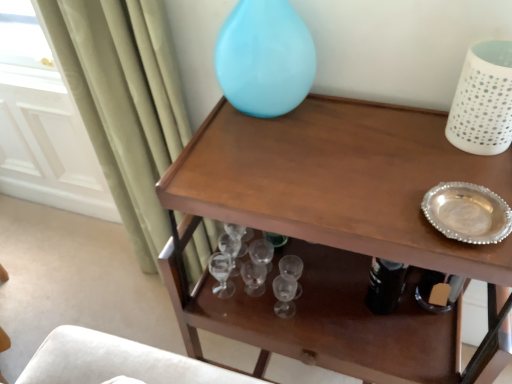
The height and width of the screenshot is (384, 512). Identify the location of white perforated vase at upper right, which is counted as the 1th vase, starting from the right. (483, 100).

Locate an element on the screen. glossy glass vase at upper center, the first vase in the left-to-right sequence is located at coordinates (265, 58).

Is white perforated vase at upper right, the second vase positioned from the left, outside of glossy glass vase at upper center, the first vase in the left-to-right sequence?

Yes, white perforated vase at upper right, the second vase positioned from the left, is located beyond the bounds of glossy glass vase at upper center, the first vase in the left-to-right sequence.

From a real-world perspective, which object rests below the other?

white perforated vase at upper right, the second vase positioned from the left, from a real-world perspective.

Is point (478, 131) in front of point (236, 16)?

Yes, point (478, 131) is closer to viewer.

Is white perforated vase at upper right, the second vase positioned from the left, positioned with its back to glossy glass vase at upper center, the first vase in the left-to-right sequence?

No, white perforated vase at upper right, the second vase positioned from the left,'s orientation is not away from glossy glass vase at upper center, the first vase in the left-to-right sequence.

From the image's perspective, between wooden table at upper center and white perforated vase at upper right, which is counted as the 1th vase, starting from the right, which one is located above?

white perforated vase at upper right, which is counted as the 1th vase, starting from the right, is shown above in the image.

How distant is wooden table at upper center from white perforated vase at upper right, which is counted as the 1th vase, starting from the right?

A distance of 32.85 centimeters exists between wooden table at upper center and white perforated vase at upper right, which is counted as the 1th vase, starting from the right.

Would you say white perforated vase at upper right, the second vase positioned from the left, is part of wooden table at upper center's contents?

No, white perforated vase at upper right, the second vase positioned from the left, is not surrounded by wooden table at upper center.

From a real-world perspective, who is located higher, wooden table at upper center or white perforated vase at upper right, the second vase positioned from the left?

white perforated vase at upper right, the second vase positioned from the left, is physically above.

Considering the positions of objects glossy glass vase at upper center, the first vase in the left-to-right sequence, and wooden table at upper center in the image provided, who is more to the right, glossy glass vase at upper center, the first vase in the left-to-right sequence, or wooden table at upper center?

wooden table at upper center.

From the image's perspective, would you say glossy glass vase at upper center, marked as the 2th vase in a right-to-left arrangement, is shown under wooden table at upper center?

Actually, glossy glass vase at upper center, marked as the 2th vase in a right-to-left arrangement, appears above wooden table at upper center in the image.

From the picture: Are glossy glass vase at upper center, the first vase in the left-to-right sequence, and wooden table at upper center located far from each other?

That's not correct — glossy glass vase at upper center, the first vase in the left-to-right sequence, is a little close to wooden table at upper center.

From the image's perspective, which object appears higher, wooden table at upper center or glossy glass vase at upper center, the first vase in the left-to-right sequence?

From the image's view, glossy glass vase at upper center, the first vase in the left-to-right sequence, is above.

Could you tell me if wooden table at upper center is turned towards glossy glass vase at upper center, the first vase in the left-to-right sequence?

No, wooden table at upper center does not turn towards glossy glass vase at upper center, the first vase in the left-to-right sequence.

Which object is more forward, wooden table at upper center or glossy glass vase at upper center, marked as the 2th vase in a right-to-left arrangement?

wooden table at upper center is in front.

From the image's perspective, starting from the wooden table at upper center, which vase is the 2nd one above? Please provide its 2D coordinates.

[(265, 58)]

Is point (492, 152) farther from camera compared to point (308, 226)?

That is True.

Which object is positioned more to the left, white perforated vase at upper right, which is counted as the 1th vase, starting from the right, or wooden table at upper center?

wooden table at upper center is more to the left.

From a real-world perspective, is white perforated vase at upper right, the second vase positioned from the left, positioned over wooden table at upper center based on gravity?

Yes.

Between white perforated vase at upper right, the second vase positioned from the left, and wooden table at upper center, which one has smaller width?

white perforated vase at upper right, the second vase positioned from the left.

Which object is more forward, glossy glass vase at upper center, the first vase in the left-to-right sequence, or white perforated vase at upper right, which is counted as the 1th vase, starting from the right?

Positioned in front is white perforated vase at upper right, which is counted as the 1th vase, starting from the right.

Which of these two, glossy glass vase at upper center, the first vase in the left-to-right sequence, or white perforated vase at upper right, the second vase positioned from the left, is thinner?

glossy glass vase at upper center, the first vase in the left-to-right sequence.

Are glossy glass vase at upper center, the first vase in the left-to-right sequence, and white perforated vase at upper right, which is counted as the 1th vase, starting from the right, beside each other?

No.

What are the coordinates of `vase above the white perforated vase at upper right, the second vase positioned from the left (from a real-world perspective)` in the screenshot? It's located at (265, 58).

I want to click on table on the left side of white perforated vase at upper right, which is counted as the 1th vase, starting from the right, so click(335, 234).

From the image, which object appears to be nearer to glossy glass vase at upper center, the first vase in the left-to-right sequence, white perforated vase at upper right, which is counted as the 1th vase, starting from the right, or wooden table at upper center?

wooden table at upper center.

When comparing their distances from wooden table at upper center, does white perforated vase at upper right, which is counted as the 1th vase, starting from the right, or glossy glass vase at upper center, marked as the 2th vase in a right-to-left arrangement, seem closer?

glossy glass vase at upper center, marked as the 2th vase in a right-to-left arrangement, is positioned closer to the anchor wooden table at upper center.

Looking at the image, which one is located further to wooden table at upper center, glossy glass vase at upper center, marked as the 2th vase in a right-to-left arrangement, or white perforated vase at upper right, the second vase positioned from the left?

white perforated vase at upper right, the second vase positioned from the left.

From the image, which object appears to be nearer to glossy glass vase at upper center, marked as the 2th vase in a right-to-left arrangement, wooden table at upper center or white perforated vase at upper right, the second vase positioned from the left?

wooden table at upper center is positioned closer to the anchor glossy glass vase at upper center, marked as the 2th vase in a right-to-left arrangement.

From the image, which object appears to be nearer to white perforated vase at upper right, which is counted as the 1th vase, starting from the right, glossy glass vase at upper center, marked as the 2th vase in a right-to-left arrangement, or wooden table at upper center?

Among the two, wooden table at upper center is located nearer to white perforated vase at upper right, which is counted as the 1th vase, starting from the right.

Considering their positions, is wooden table at upper center positioned closer to white perforated vase at upper right, the second vase positioned from the left, than glossy glass vase at upper center, marked as the 2th vase in a right-to-left arrangement?

wooden table at upper center is positioned closer to the anchor white perforated vase at upper right, the second vase positioned from the left.

Where is `vase between glossy glass vase at upper center, the first vase in the left-to-right sequence, and wooden table at upper center, in the vertical direction`? vase between glossy glass vase at upper center, the first vase in the left-to-right sequence, and wooden table at upper center, in the vertical direction is located at coordinates (483, 100).